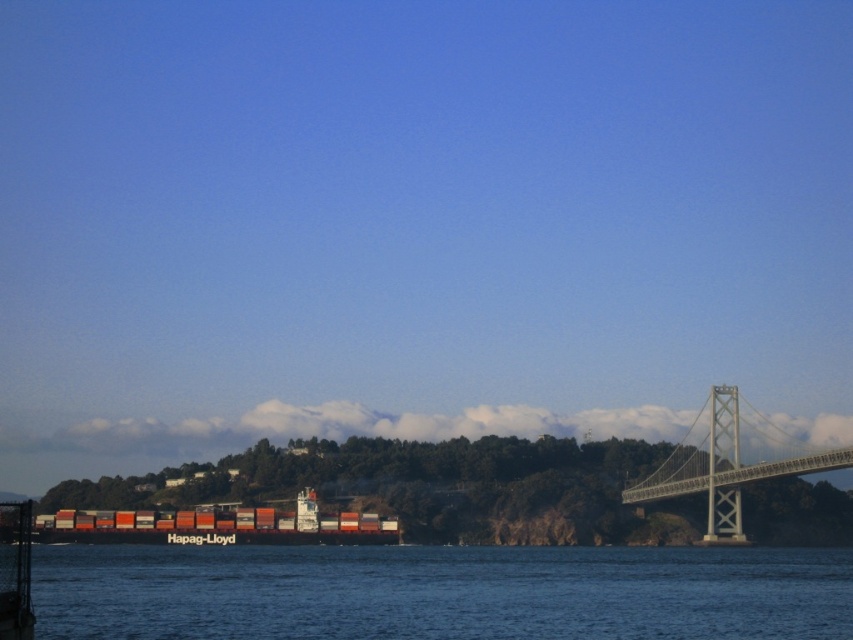
You are a drone operator tasked with capturing aerial footage of the gray metallic bridge at right. Your drone has a maximum flight range of 100 meters from your current position. Based on the coordinates provided, can you determine if your drone can reach the bridge?

The gray metallic bridge at right is located at coordinates point (730, 461). Since the drone has a maximum flight range of 100 meters, it can easily reach the bridge as the distance is well within the limit.

You are a photographer standing at the edge of the waterfront, aiming to capture the cargo ship and the bridge in your shot. You notice two points marked in the scene. Which of the two points, point (776,456) or point (218,525), is closer to your camera position?

Point (218,525) is closer to the camera because it is less further than point (776,456).

You are a photographer standing at the dock and want to capture a photo of the gray metallic bridge at right and the blue water at lower center. Which object should you focus on first if you want to include both in the same frame without moving your camera?

The blue water at lower center is positioned on the left side of gray metallic bridge at right, so you should focus on the gray metallic bridge at right first to ensure both objects are in the frame.